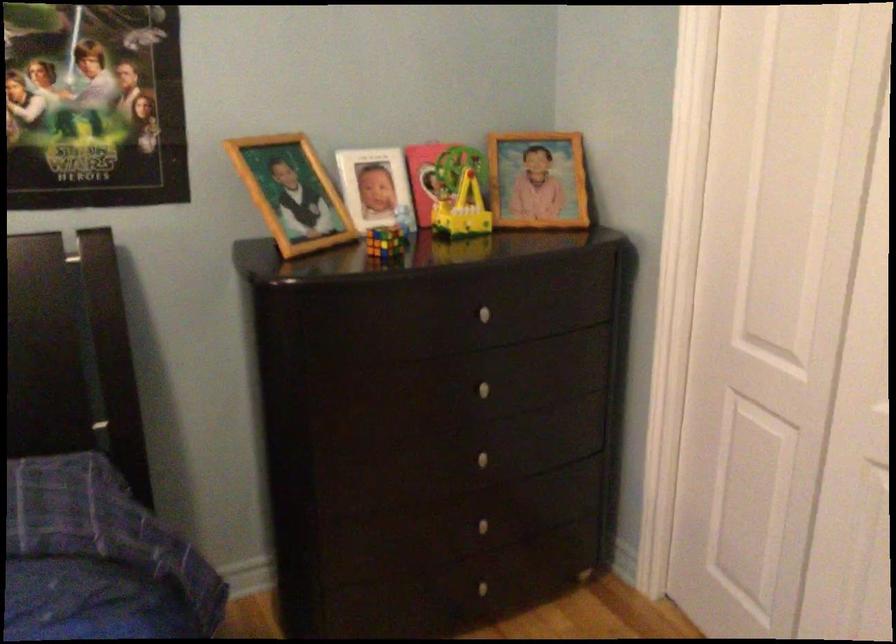
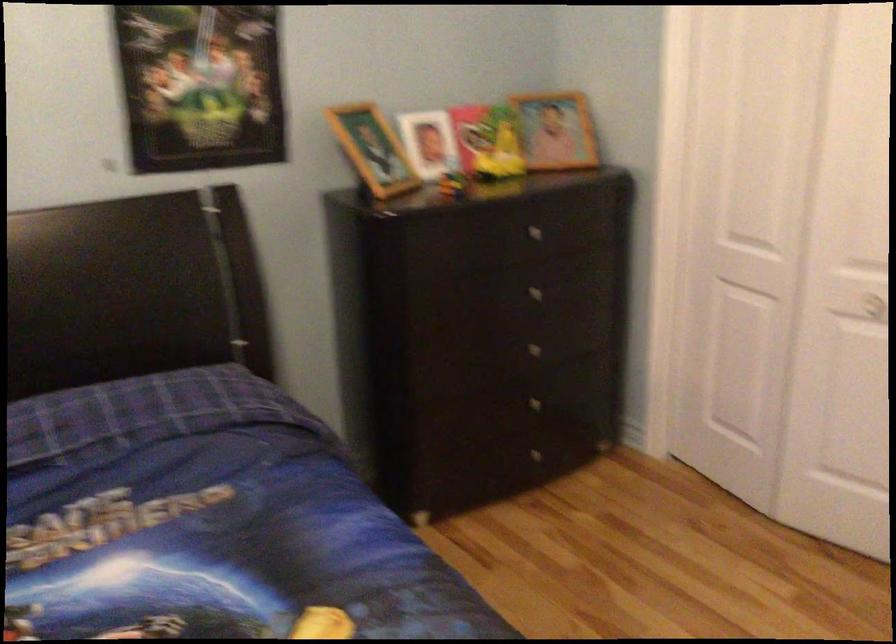
Question: The first image is from the beginning of the video and the second image is from the end. How did the camera likely rotate when shooting the video?

Choices:
 (A) Left
 (B) Right
 (C) Up
 (D) Down

Answer: (B)